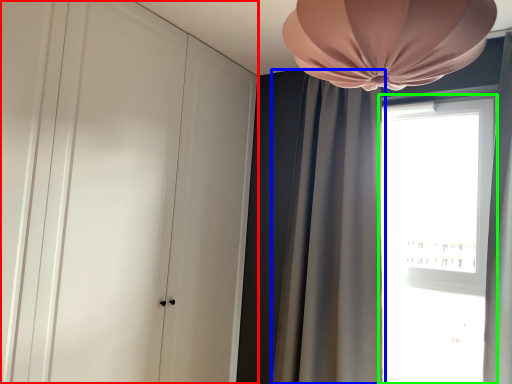
Question: Which is farther away from dresser (highlighted by a red box)? curtain (highlighted by a blue box) or window (highlighted by a green box)?

Choices:
 (A) curtain
 (B) window

Answer: (B)